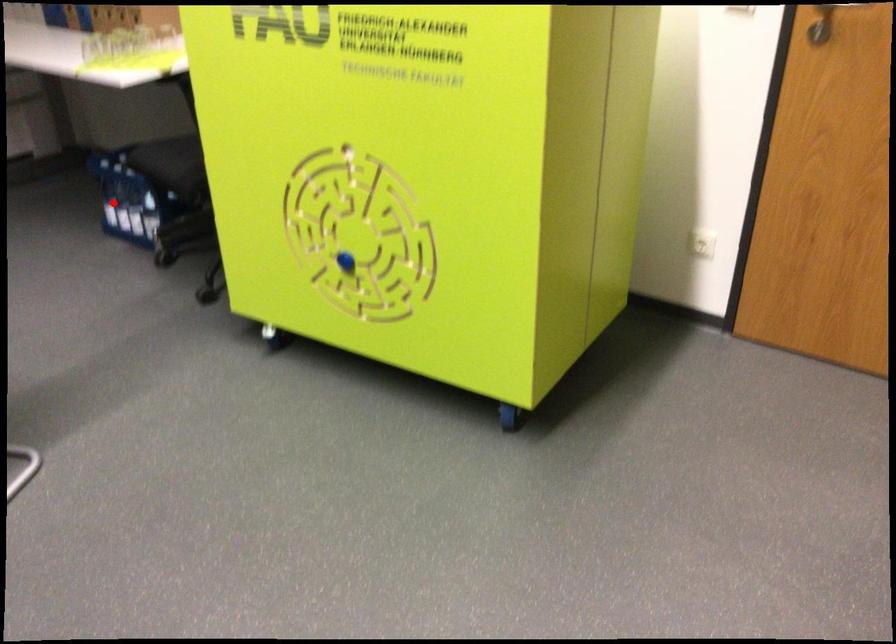
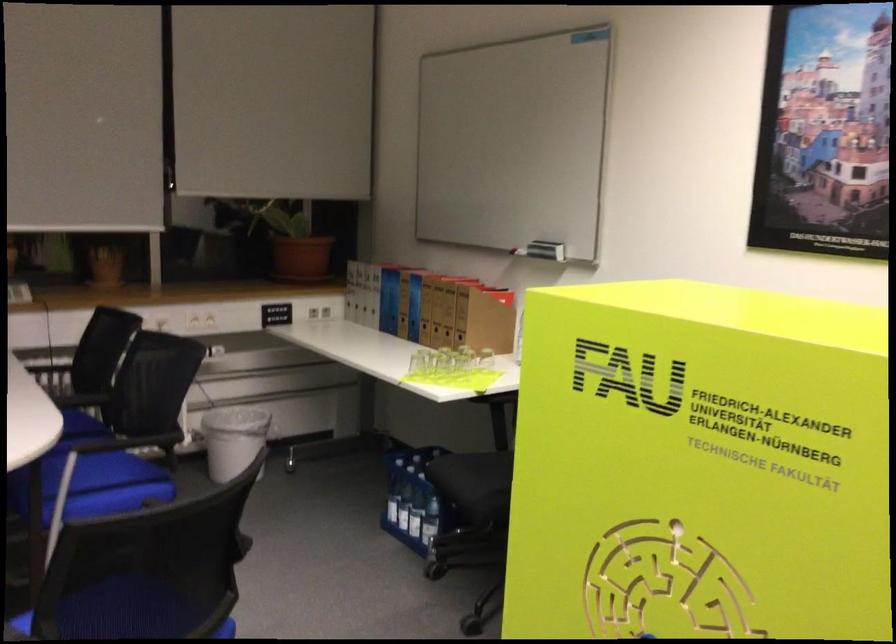
The point at the highlighted location is marked in the first image. Where is the corresponding point in the second image?

(392, 500)